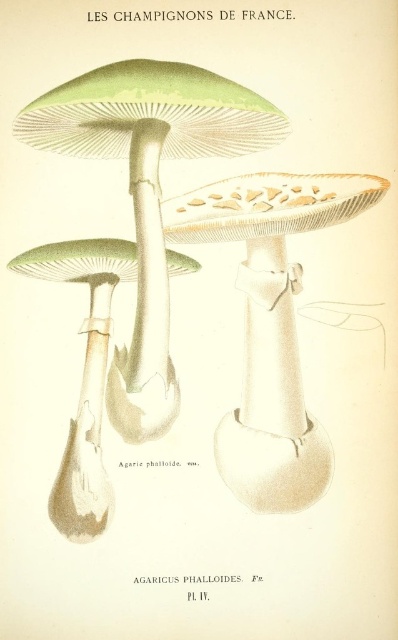
Question: Which of the following is the farthest from the observer?

Choices:
 (A) (220, 424)
 (B) (148, 284)
 (C) (101, 454)

Answer: (A)

Question: Is green matte agaricus phalloides at center bigger than smooth beige mushroom at center?

Choices:
 (A) no
 (B) yes

Answer: (B)

Question: In this image, where is smooth beige mushroom at center located relative to green matte mushroom at center?

Choices:
 (A) below
 (B) above

Answer: (B)

Question: Which object is closer to the camera taking this photo?

Choices:
 (A) smooth beige mushroom at center
 (B) green matte mushroom at center
 (C) green matte agaricus phalloides at center

Answer: (C)

Question: Which object appears closest to the camera in this image?

Choices:
 (A) green matte mushroom at center
 (B) smooth beige mushroom at center
 (C) green matte agaricus phalloides at center

Answer: (C)

Question: Is smooth beige mushroom at center to the right of green matte mushroom at center from the viewer's perspective?

Choices:
 (A) yes
 (B) no

Answer: (A)